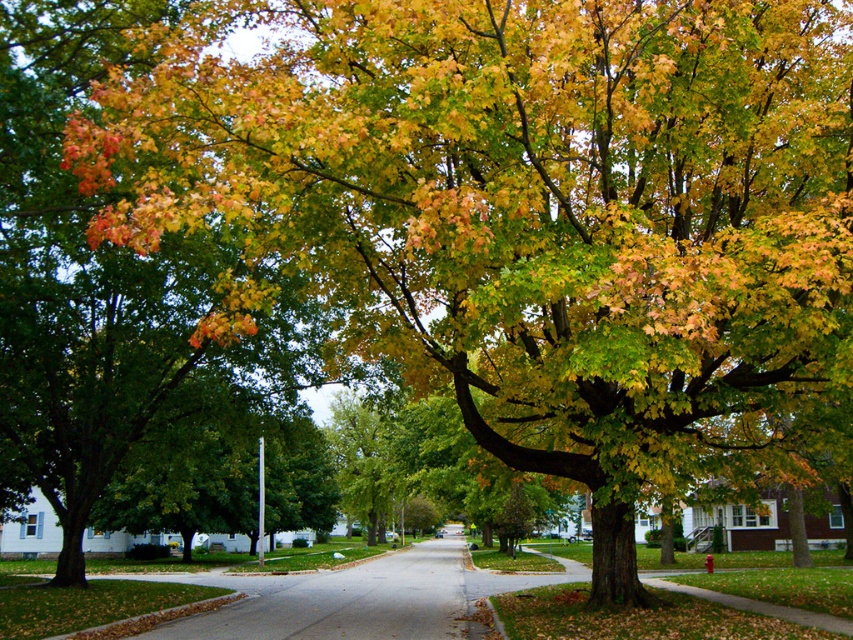
Does shiny green leaves at center appear on the right side of gray asphalt road at center?

In fact, shiny green leaves at center is to the left of gray asphalt road at center.

In the scene shown: Which of these two, shiny green leaves at center or gray asphalt road at center, stands taller?

shiny green leaves at center is taller.

Where is `shiny green leaves at center`? Image resolution: width=853 pixels, height=640 pixels. shiny green leaves at center is located at coordinates (102, 282).

You are a GUI agent. You are given a task and a screenshot of the screen. Output one action in this format:
    pyautogui.click(x=<x>, y=<y>)
    Task: Click on the shiny green leaves at center
    The image size is (853, 640).
    Given the screenshot: What is the action you would take?
    pyautogui.click(x=102, y=282)